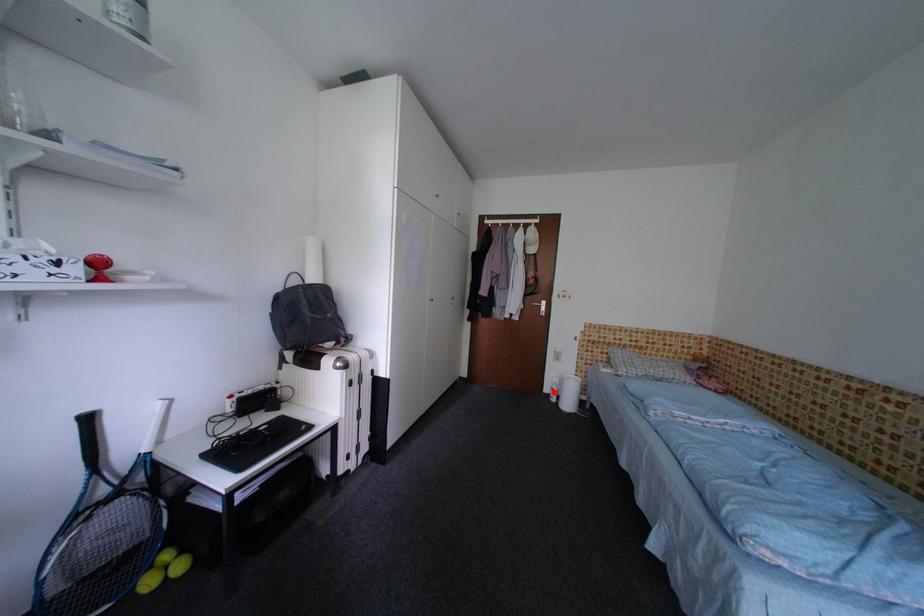
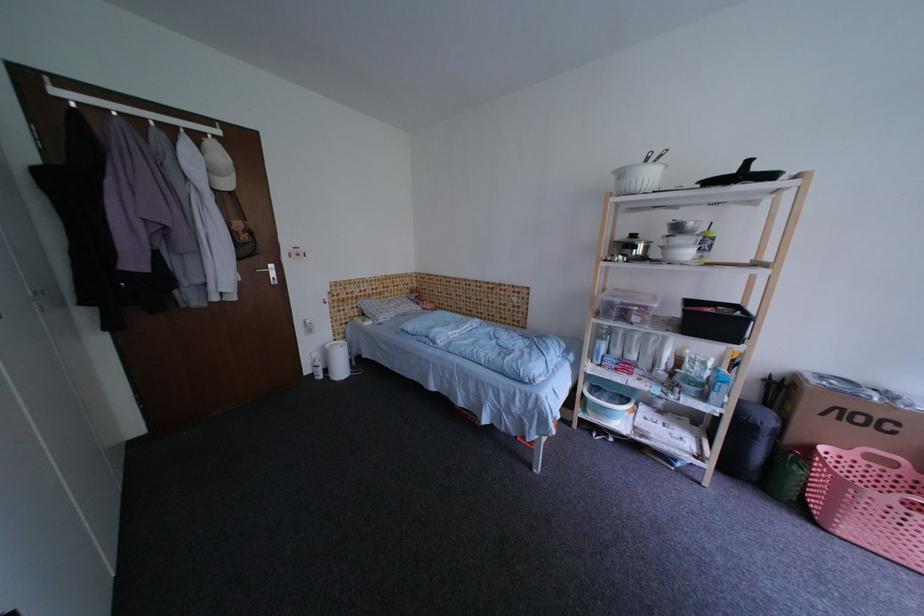
Where in the second image is the point corresponding to the highlighted location from the first image?

(314, 374)